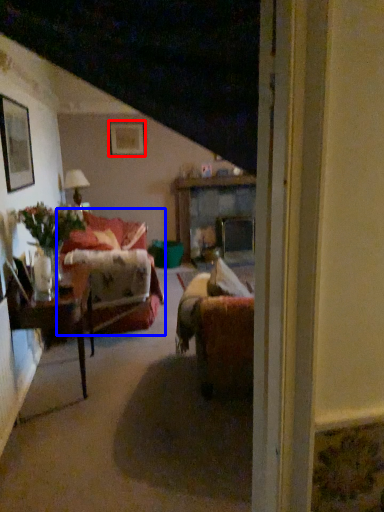
Question: Which of the following is the farthest to the observer, picture frame (highlighted by a red box) or studio couch (highlighted by a blue box)?

Choices:
 (A) picture frame
 (B) studio couch

Answer: (A)